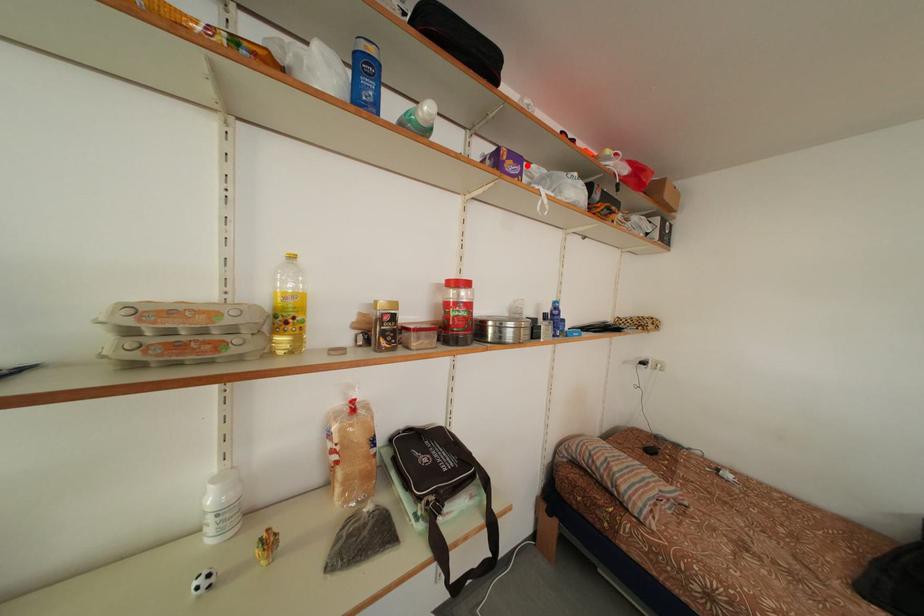
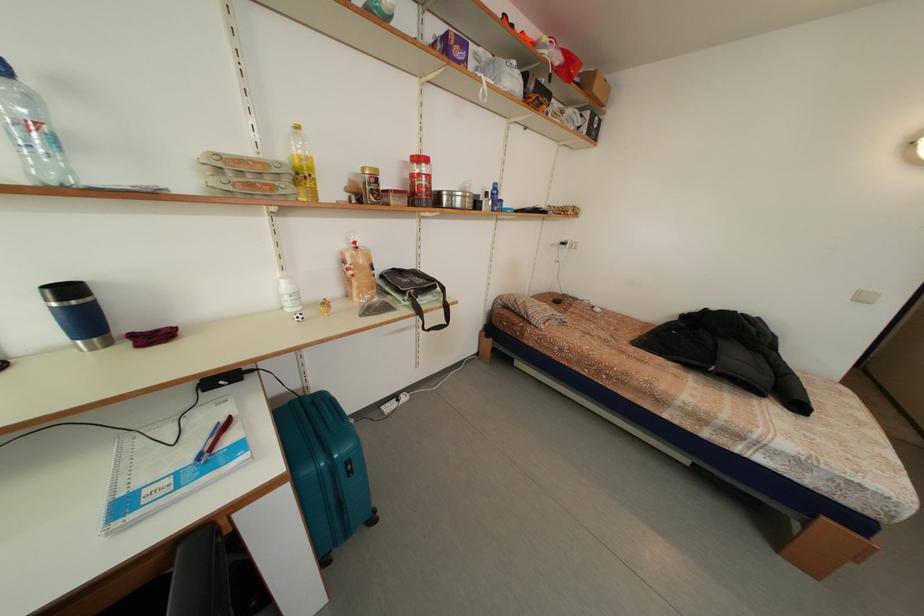
Question: I am providing you with two images of the same scene from different viewpoints. A red point is marked on the first image. At the location where the point appears in image 1, is it still visible in image 2?

Choices:
 (A) Yes
 (B) No

Answer: (A)